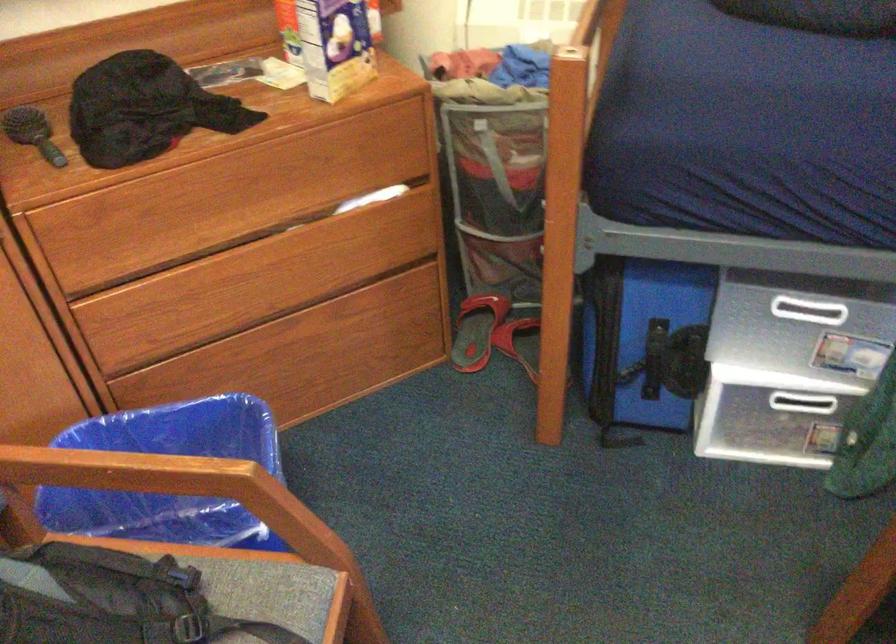
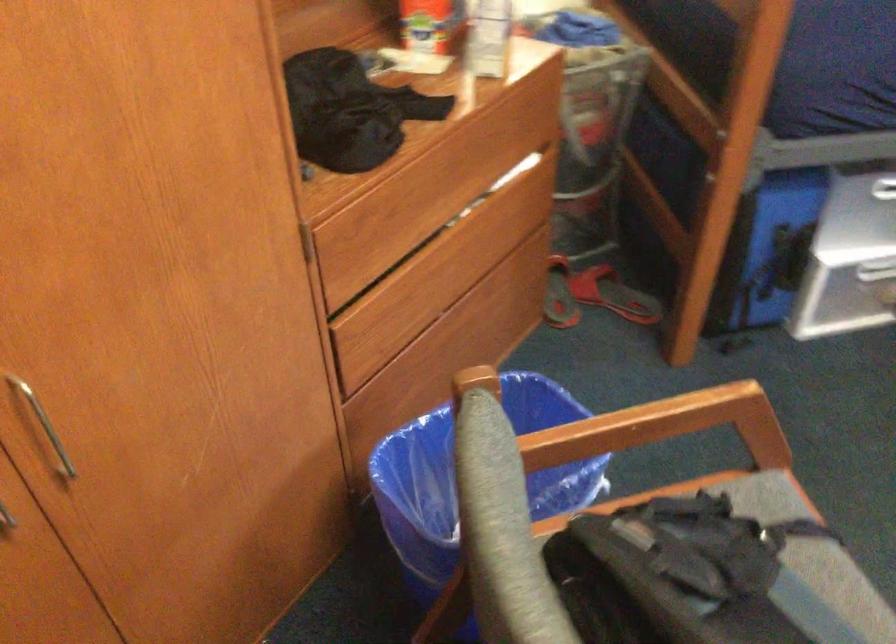
Question: Which direction would the cameraman need to move to produce the second image? Reply with the corresponding letter.

Choices:
 (A) Left
 (B) Right
 (C) Forward
 (D) Backward

Answer: (A)